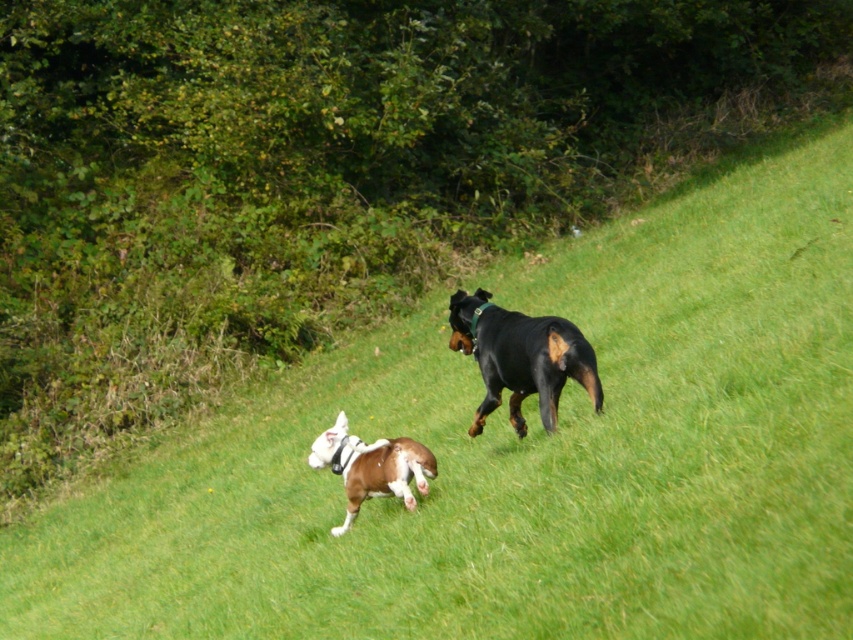
Question: Where is black glossy dog at center located in relation to brown glossy dog at center in the image?

Choices:
 (A) above
 (B) below

Answer: (A)

Question: Which point appears farthest from the camera in this image?

Choices:
 (A) (334, 422)
 (B) (469, 342)

Answer: (A)

Question: Which point is closer to the camera?

Choices:
 (A) black glossy dog at center
 (B) brown glossy dog at center

Answer: (A)

Question: Does black glossy dog at center lie behind brown glossy dog at center?

Choices:
 (A) no
 (B) yes

Answer: (A)

Question: Observing the image, what is the correct spatial positioning of black glossy dog at center in reference to brown glossy dog at center?

Choices:
 (A) left
 (B) right

Answer: (B)

Question: Which point is closer to the camera?

Choices:
 (A) tap(509, 344)
 (B) tap(413, 499)

Answer: (B)